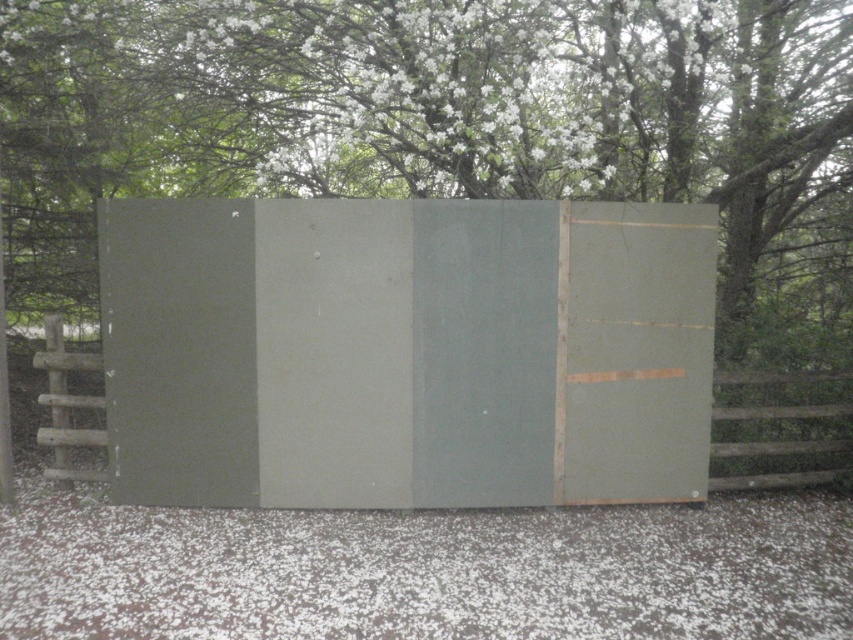
You are standing in front of a wooden fence with a gray panel and some green walls. You need to hang a small birdhouse between the green matte wall at upper center and the matte green panel at center. According to the scene, which object should the birdhouse be placed to the left of?

The green matte wall at upper center is to the right of the matte green panel at center, so the birdhouse should be placed to the left of the matte green panel at center.

You are standing in a garden and want to place a new decorative vase between the matte green panel at center and the brown wooden fence at right. Based on their positions, which object should the vase be closer to?

The matte green panel at center is closer to the viewer than the brown wooden fence at right, so the vase should be placed closer to the brown wooden fence at right to maintain the spatial arrangement.

You are an artist planning to paint a mural on the green matte wall at upper center and the matte green panel at center. You need to know which surface is wider to decide where to place the main subject. Which one is narrower?

The green matte wall at upper center is narrower than the matte green panel at center because its width is less than the panel.